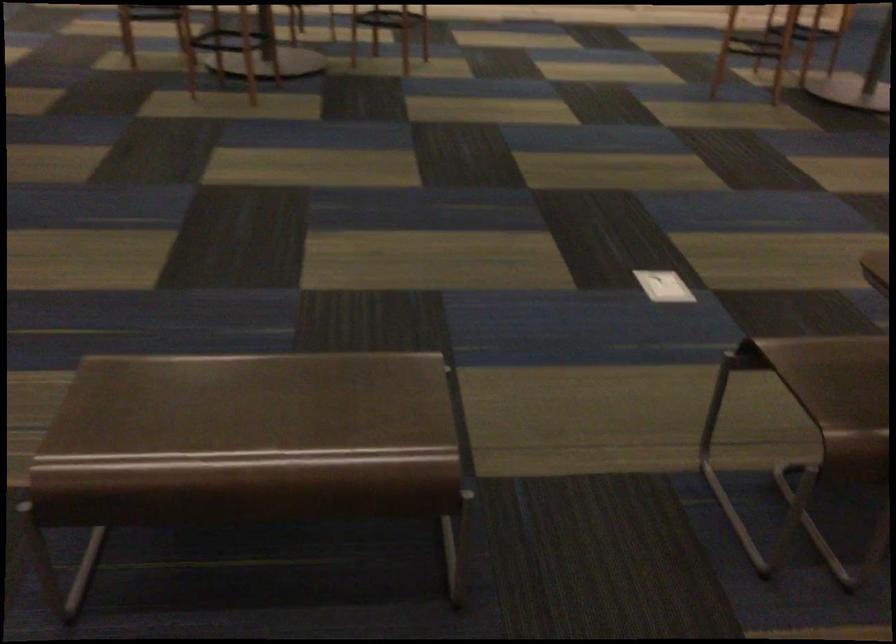
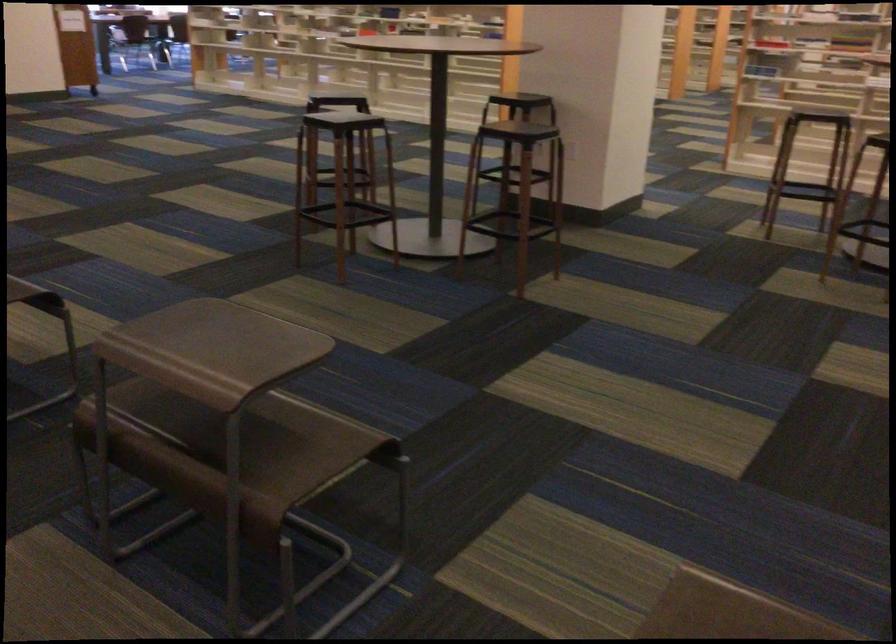
Question: The images are taken continuously from a first-person perspective. In which direction is your viewpoint rotating?

Choices:
 (A) Left
 (B) Right
 (C) Up
 (D) Down

Answer: (A)